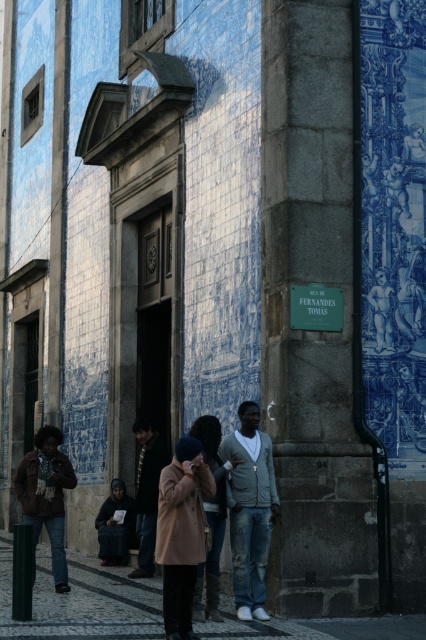
Who is higher up, dark gray concrete sidewalk at lower center or blue glazed tile at upper right?

blue glazed tile at upper right

Who is more distant from viewer, (298, 625) or (393, 305)?

The point (393, 305) is more distant.

The width and height of the screenshot is (426, 640). Describe the element at coordinates (81, 602) in the screenshot. I see `dark gray concrete sidewalk at lower center` at that location.

I want to click on dark gray concrete sidewalk at lower center, so click(81, 602).

Can you confirm if denim jeans at center is taller than dark brown leather jacket at center?

Incorrect, denim jeans at center's height is not larger of dark brown leather jacket at center's.

Does point (245, 588) lie in front of point (146, 484)?

Yes, it is.

Does point (261, 602) come farther from viewer compared to point (138, 435)?

No, (261, 602) is closer to viewer.

This screenshot has height=640, width=426. What are the coordinates of `denim jeans at center` in the screenshot? It's located at (250, 509).

Who is positioned more to the right, beige wool coat at center or dark brown leather jacket at lower center?

From the viewer's perspective, beige wool coat at center appears more on the right side.

Does beige wool coat at center have a larger size compared to dark brown leather jacket at lower center?

No, beige wool coat at center is not bigger than dark brown leather jacket at lower center.

Describe the element at coordinates (181, 532) in the screenshot. The image size is (426, 640). I see `beige wool coat at center` at that location.

I want to click on beige wool coat at center, so click(x=181, y=532).